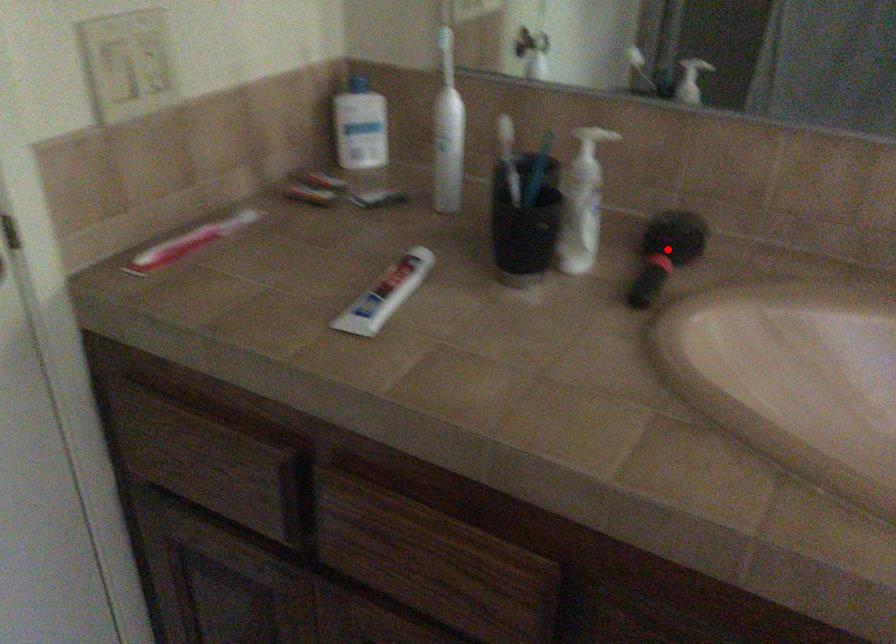
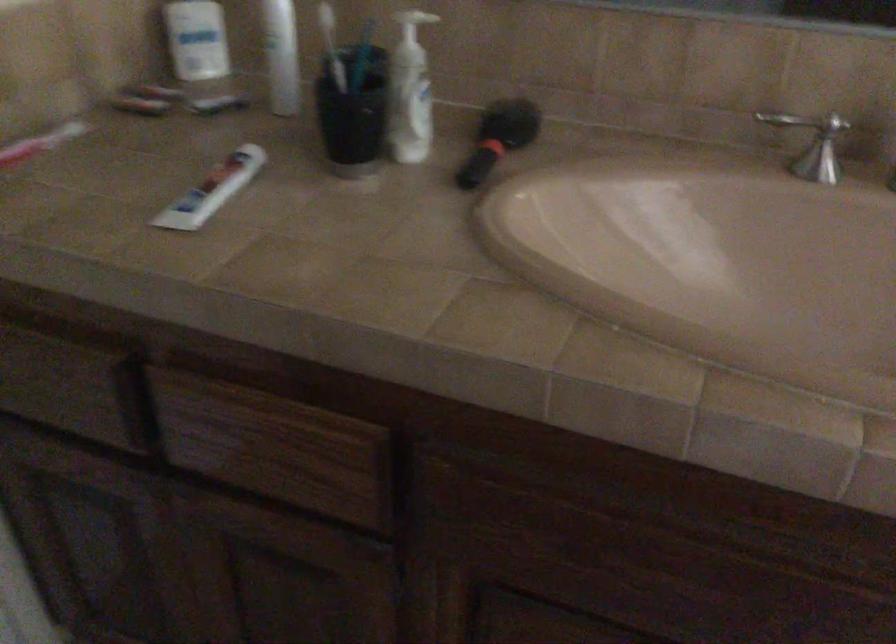
Locate, in the second image, the point that corresponds to the highlighted location in the first image.

(498, 138)